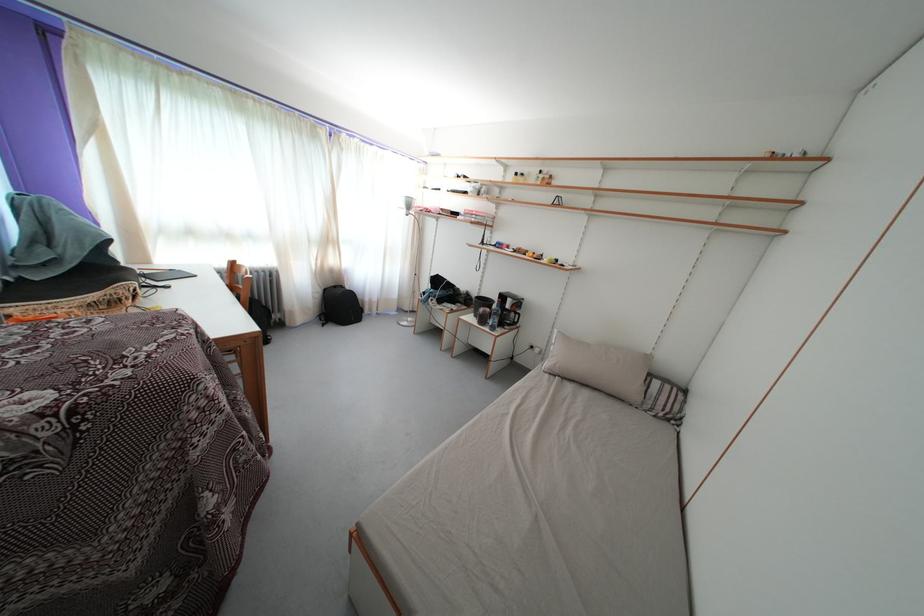
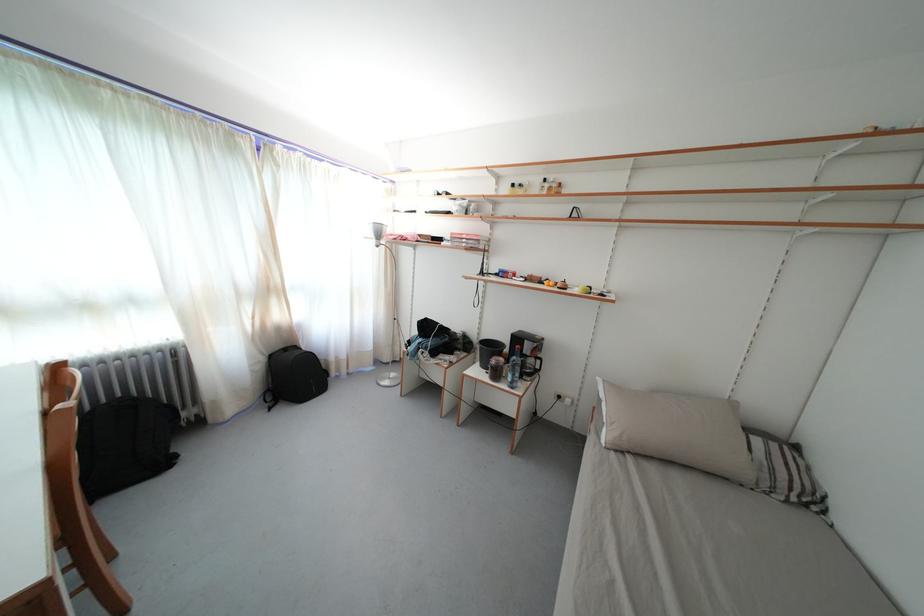
In the second image, find the point that corresponds to [489,301] in the first image.

(491, 341)